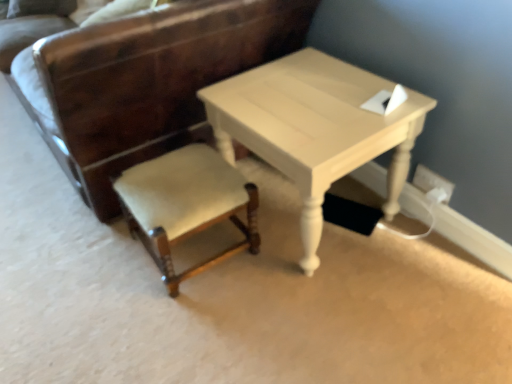
Where is `vacant space positioned to the left of velvet beige stool at center, which appears as the 1th chair when ordered from the bottom`? The image size is (512, 384). vacant space positioned to the left of velvet beige stool at center, which appears as the 1th chair when ordered from the bottom is located at coordinates (95, 274).